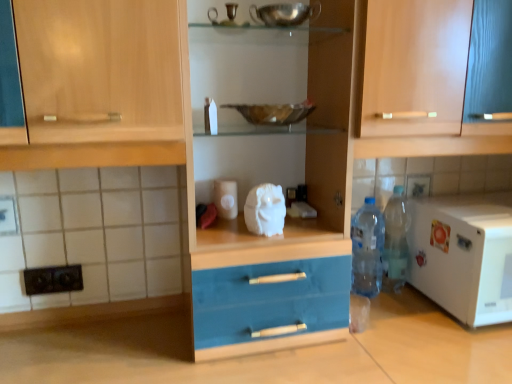
Question: Considering the relative sizes of white matte microwave at right and metallic reflective bowl at center in the image provided, is white matte microwave at right smaller than metallic reflective bowl at center?

Choices:
 (A) yes
 (B) no

Answer: (B)

Question: Does white matte microwave at right appear on the right side of metallic reflective bowl at center?

Choices:
 (A) yes
 (B) no

Answer: (A)

Question: Is white matte microwave at right bigger than metallic reflective bowl at center?

Choices:
 (A) yes
 (B) no

Answer: (A)

Question: Is white matte microwave at right not near metallic reflective bowl at center?

Choices:
 (A) no
 (B) yes

Answer: (A)

Question: Is white matte microwave at right with metallic reflective bowl at center?

Choices:
 (A) no
 (B) yes

Answer: (A)

Question: Can you confirm if white matte microwave at right is positioned to the left of metallic reflective bowl at center?

Choices:
 (A) yes
 (B) no

Answer: (B)

Question: Considering the relative sizes of white glossy tile at upper center and white matte microwave at right in the image provided, is white glossy tile at upper center shorter than white matte microwave at right?

Choices:
 (A) yes
 (B) no

Answer: (A)

Question: Is white glossy tile at upper center with white matte microwave at right?

Choices:
 (A) yes
 (B) no

Answer: (B)

Question: Can you confirm if white glossy tile at upper center is positioned to the right of white matte microwave at right?

Choices:
 (A) yes
 (B) no

Answer: (B)

Question: Can you confirm if white glossy tile at upper center is bigger than white matte microwave at right?

Choices:
 (A) yes
 (B) no

Answer: (B)

Question: Considering the relative sizes of white glossy tile at upper center and white matte microwave at right in the image provided, is white glossy tile at upper center thinner than white matte microwave at right?

Choices:
 (A) no
 (B) yes

Answer: (B)

Question: From a real-world perspective, is white glossy tile at upper center physically above white matte microwave at right?

Choices:
 (A) yes
 (B) no

Answer: (A)

Question: Is metallic reflective bowl at center taller than wooden cabinet at upper center?

Choices:
 (A) no
 (B) yes

Answer: (A)